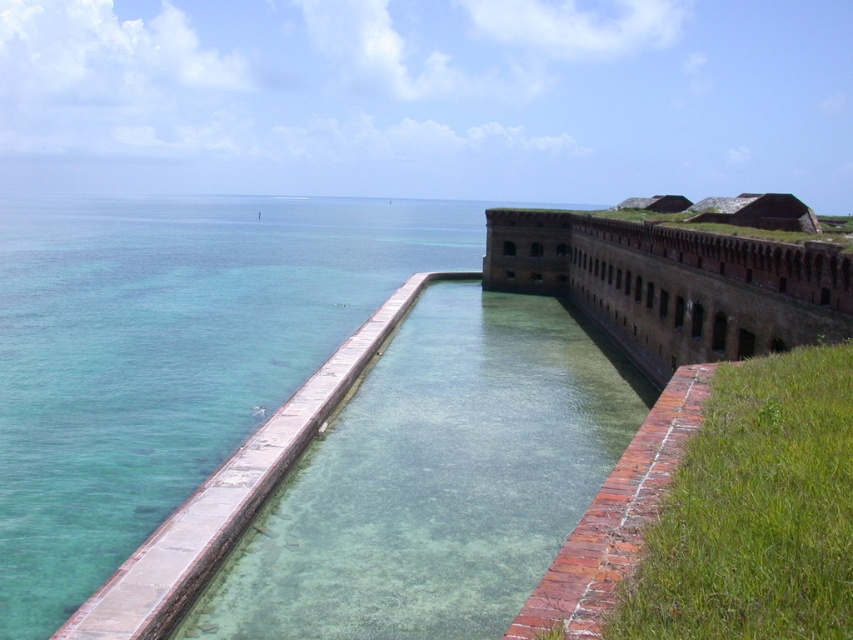
Question: Does clear concrete pool at center have a lesser width compared to brown brick wall at center?

Choices:
 (A) yes
 (B) no

Answer: (B)

Question: Which object appears farthest from the camera in this image?

Choices:
 (A) clear concrete pool at center
 (B) brown brick wall at center

Answer: (B)

Question: Is clear concrete pool at center thinner than brown brick wall at center?

Choices:
 (A) no
 (B) yes

Answer: (A)

Question: Which point appears farthest from the camera in this image?

Choices:
 (A) (494, 220)
 (B) (524, 500)

Answer: (A)

Question: Is clear concrete pool at center below brown brick wall at center?

Choices:
 (A) no
 (B) yes

Answer: (B)

Question: Which of the following is the farthest from the observer?

Choices:
 (A) (722, 259)
 (B) (520, 602)

Answer: (A)